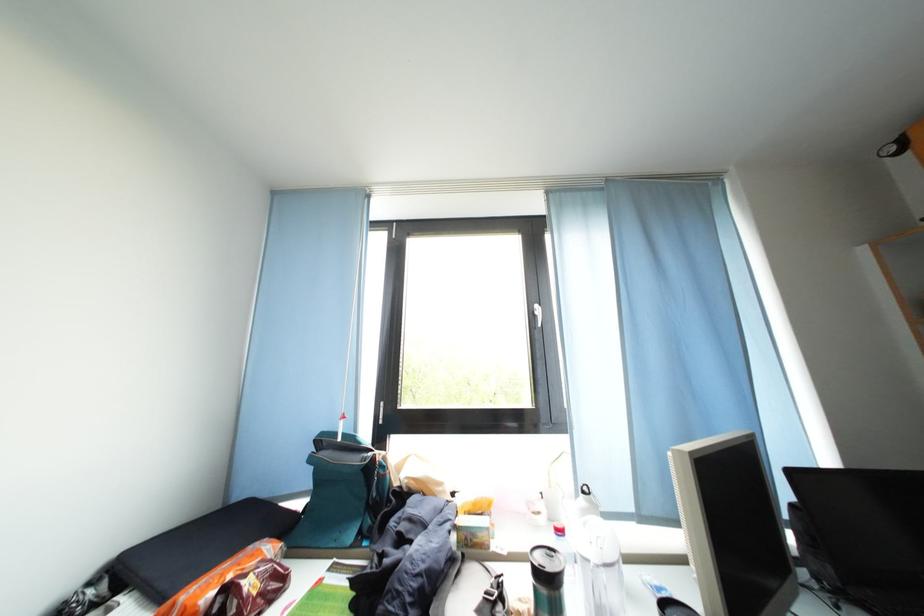
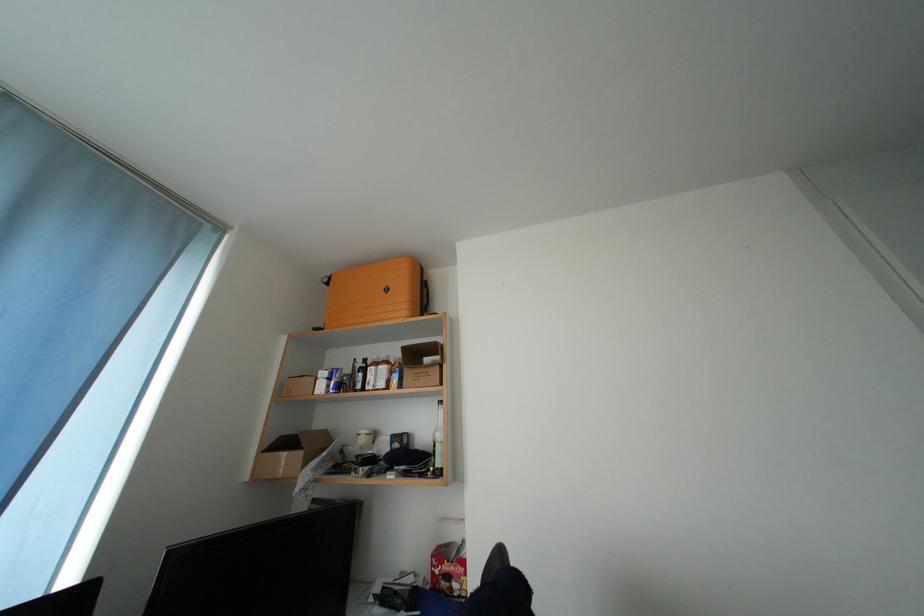
The first image is from the beginning of the video and the second image is from the end. How did the camera likely rotate when shooting the video?

The camera rotated toward right-up.